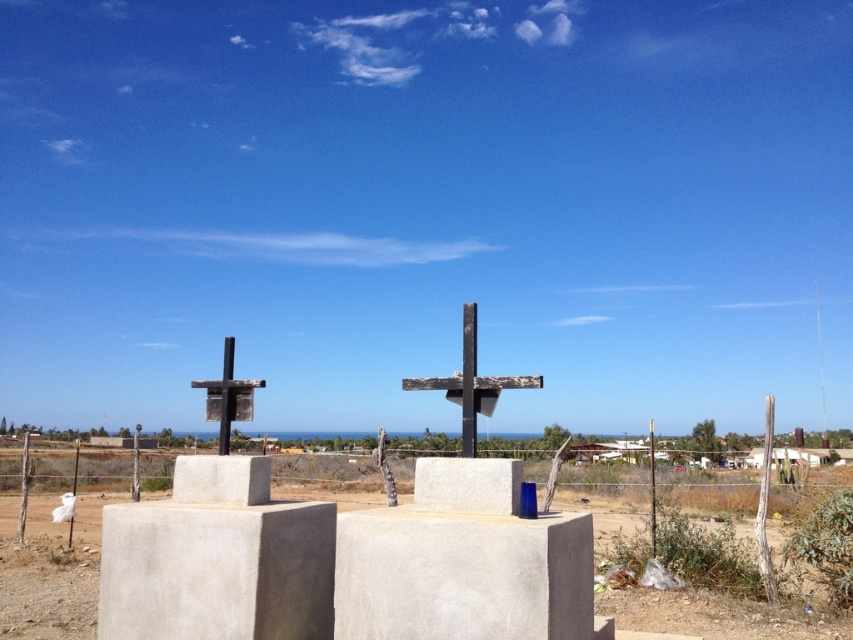
In the scene shown: You are standing in the rural landscape described and notice the white concrete block at center and the smooth wooden cross at center. Which object is directly above the other?

The smooth wooden cross at center is directly above the white concrete block at center because the white concrete block at center is positioned under it.

From the picture: You are standing in the rural landscape depicted in the image. You need to place a 5 meter long ladder between you and the gray concrete block at center. Is the distance sufficient to fit the ladder horizontally between you and the block?

The distance of gray concrete block at center from viewer is 4.94 meters, which is slightly less than the ladder length of 5 meters. Therefore, the ladder cannot be placed horizontally between you and the gray concrete block at center as there is insufficient space.

You are standing at the white concrete block at center. There is a fence post 4.72 meters away from you. Can you reach the fence post by walking straight ahead without turning?

The distance between the white concrete block at center and the fence post is 4.72 meters, so yes, you can reach the fence post by walking straight ahead without turning since it is within a reasonable distance.